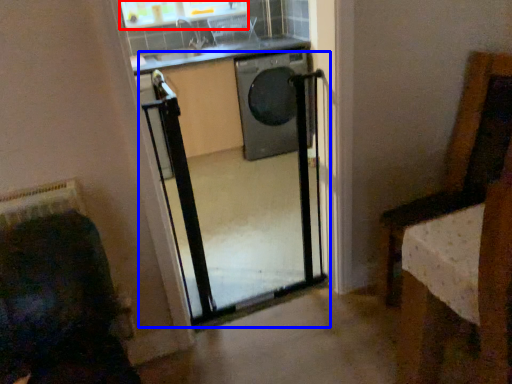
Question: Which object is further to the camera taking this photo, window (highlighted by a red box) or screen door (highlighted by a blue box)?

Choices:
 (A) window
 (B) screen door

Answer: (A)